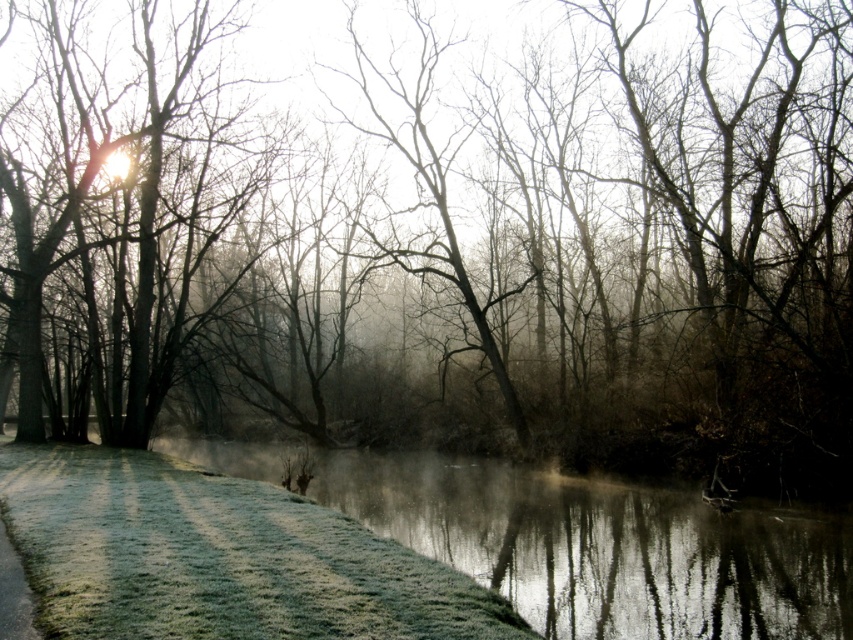
Looking at this image, you are standing at the frosty path and see two points in the scene. Which point is closer to you, point (x=521, y=572) or point (x=12, y=509)?

Point (x=12, y=509) is closer to you because it is less further to the camera than point (x=521, y=572).

You are an outdoor photographer planning to capture the reflection of the frosted glass river at lower center and the green frosty grass at lower left in your shot. Which object will occupy more space in the photo frame?

The frosted glass river at lower center will occupy more space in the photo frame since it has a larger size compared to the green frosty grass at lower left.

You are standing at the edge of the frosty area and want to cross to the other side. The frosted glass river at lower center is in your path. Can you safely walk across it?

The frosted glass river at lower center is 10.48 meters from viewer, so it is possible to walk across it safely as long as the ice is thick enough to support your weight.